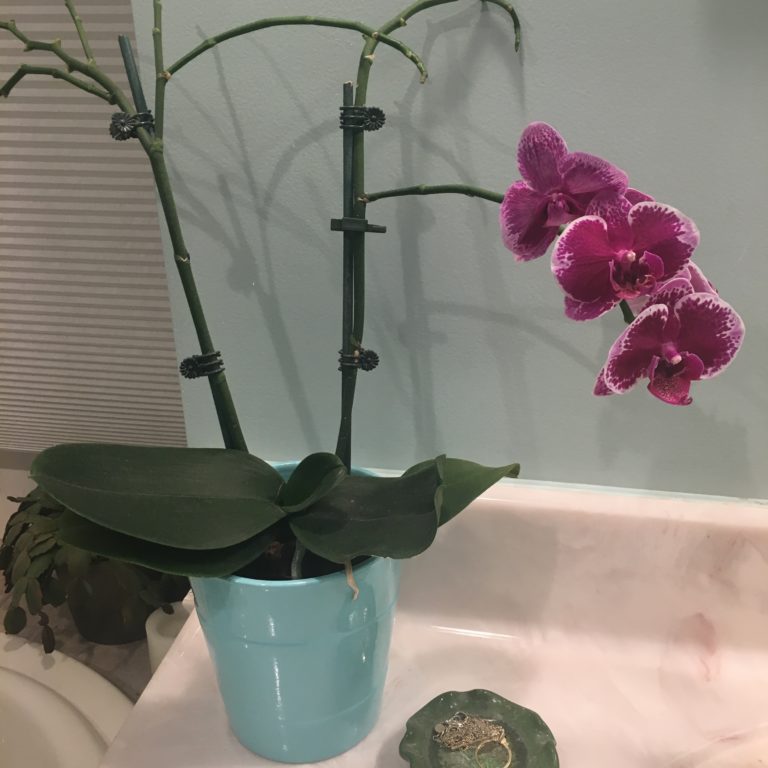
The height and width of the screenshot is (768, 768). Find the location of `plant`. plant is located at coordinates (78, 558).